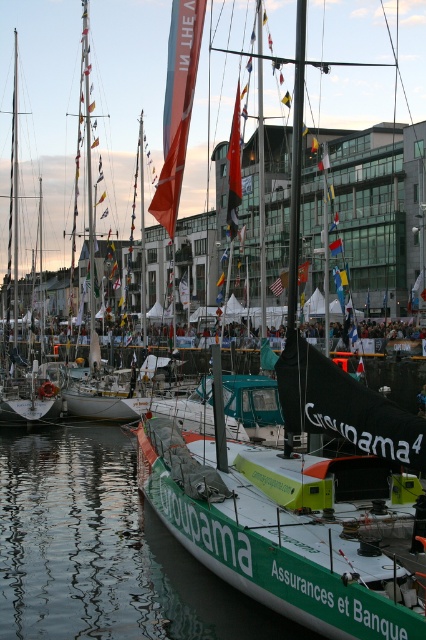
You are a harbor security officer who needs to ensure that all boats are at least 50 meters apart for safety regulations. You observe the green matte sailboat at center and the white matte sailboat at left in the marina. Based on your current observations, do these two boats meet the safety distance requirement?

The green matte sailboat at center and white matte sailboat at left are 49.81 meters apart from each other, which is less than the required 50 meters. Therefore, these boats do not meet the safety distance requirement and need to be moved further apart.

You are a photographer trying to capture the green matte sailboat at center and the green smooth water at lower left in a single shot. Which object should you focus on first if you want to ensure both are in frame without moving the camera?

The green matte sailboat at center is bigger than the green smooth water at lower left, so you should focus on the larger object first to ensure both fit in the frame.

You are a photographer standing at the edge of the marina, wanting to capture a shot of the white matte sailboat at left and the green smooth water at lower left. From your current position, which object is closer to the right side of your camera frame?

The green smooth water at lower left is positioned on the right side of white matte sailboat at left, so the green smooth water at lower left is closer to the right side of the camera frame.